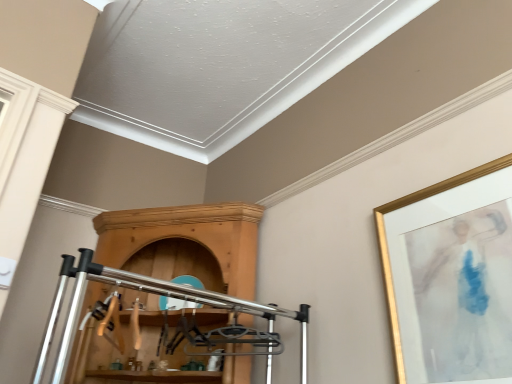
Question: Can you confirm if wooden cabinet at center is smaller than gold-framed artwork at upper right?

Choices:
 (A) yes
 (B) no

Answer: (B)

Question: Considering the relative sizes of wooden cabinet at center and gold-framed artwork at upper right in the image provided, is wooden cabinet at center bigger than gold-framed artwork at upper right?

Choices:
 (A) no
 (B) yes

Answer: (B)

Question: Can you confirm if wooden cabinet at center is wider than gold-framed artwork at upper right?

Choices:
 (A) yes
 (B) no

Answer: (A)

Question: From a real-world perspective, is wooden cabinet at center on gold-framed artwork at upper right?

Choices:
 (A) no
 (B) yes

Answer: (B)

Question: Is wooden cabinet at center at the right side of gold-framed artwork at upper right?

Choices:
 (A) yes
 (B) no

Answer: (B)

Question: Would you say gold-framed artwork at upper right is part of wooden cabinet at center's contents?

Choices:
 (A) yes
 (B) no

Answer: (B)

Question: Can you confirm if gold-framed artwork at upper right is shorter than wooden cabinet at center?

Choices:
 (A) yes
 (B) no

Answer: (A)

Question: Can you confirm if gold-framed artwork at upper right is thinner than wooden cabinet at center?

Choices:
 (A) no
 (B) yes

Answer: (B)

Question: Is gold-framed artwork at upper right looking in the opposite direction of wooden cabinet at center?

Choices:
 (A) no
 (B) yes

Answer: (A)

Question: Would you say wooden cabinet at center is part of gold-framed artwork at upper right's contents?

Choices:
 (A) yes
 (B) no

Answer: (B)

Question: Is gold-framed artwork at upper right positioned in front of wooden cabinet at center?

Choices:
 (A) yes
 (B) no

Answer: (A)

Question: Is gold-framed artwork at upper right bigger than wooden cabinet at center?

Choices:
 (A) no
 (B) yes

Answer: (A)

Question: Considering the positions of point (411, 326) and point (196, 380), is point (411, 326) closer or farther from the camera than point (196, 380)?

Choices:
 (A) closer
 (B) farther

Answer: (A)